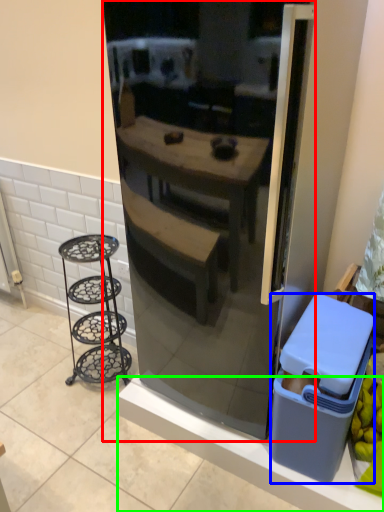
Question: Which is farther away from refrigerator (highlighted by a red box)? trash bin/can (highlighted by a blue box) or ledge (highlighted by a green box)?

Choices:
 (A) trash bin/can
 (B) ledge

Answer: (B)